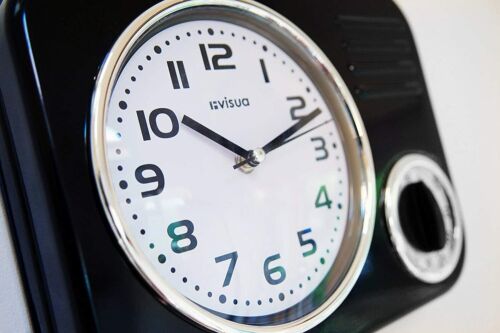
Identify the location of clock face. The width and height of the screenshot is (500, 333). coord(254,224).